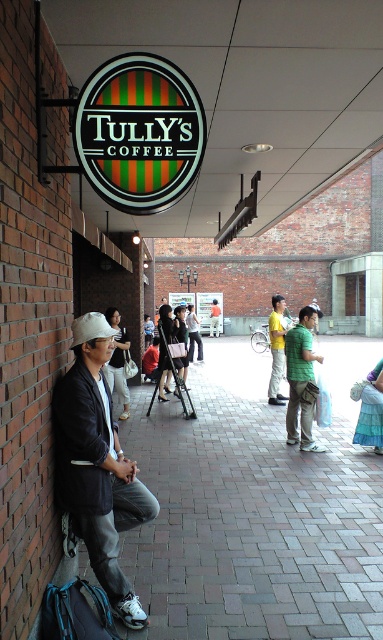
Does brick pavement at center have a lesser height compared to yellow cotton shirt at center?

Correct, brick pavement at center is not as tall as yellow cotton shirt at center.

Between brick pavement at center and yellow cotton shirt at center, which one has less height?

brick pavement at center is shorter.

Between point (219, 515) and point (268, 316), which one is positioned in front?

Positioned in front is point (219, 515).

What are the coordinates of `brick pavement at center` in the screenshot? It's located at (255, 509).

Who is more forward, (121, 451) or (214, 332)?

Positioned in front is point (121, 451).

Which is below, dark gray leather jacket at left or orange shirt at center?

Positioned lower is dark gray leather jacket at left.

Is point (86, 477) farther from camera compared to point (212, 310)?

No, it is not.

Locate an element on the screen. Image resolution: width=383 pixels, height=640 pixels. dark gray leather jacket at left is located at coordinates (96, 465).

Is green matte shirt at center thinner than yellow cotton shirt at center?

In fact, green matte shirt at center might be wider than yellow cotton shirt at center.

Is green matte shirt at center wider than yellow cotton shirt at center?

Yes, green matte shirt at center is wider than yellow cotton shirt at center.

Is point (296, 422) positioned behind point (278, 337)?

No, (296, 422) is closer to viewer.

Find the location of a particular element. This screenshot has height=640, width=383. green matte shirt at center is located at coordinates (301, 380).